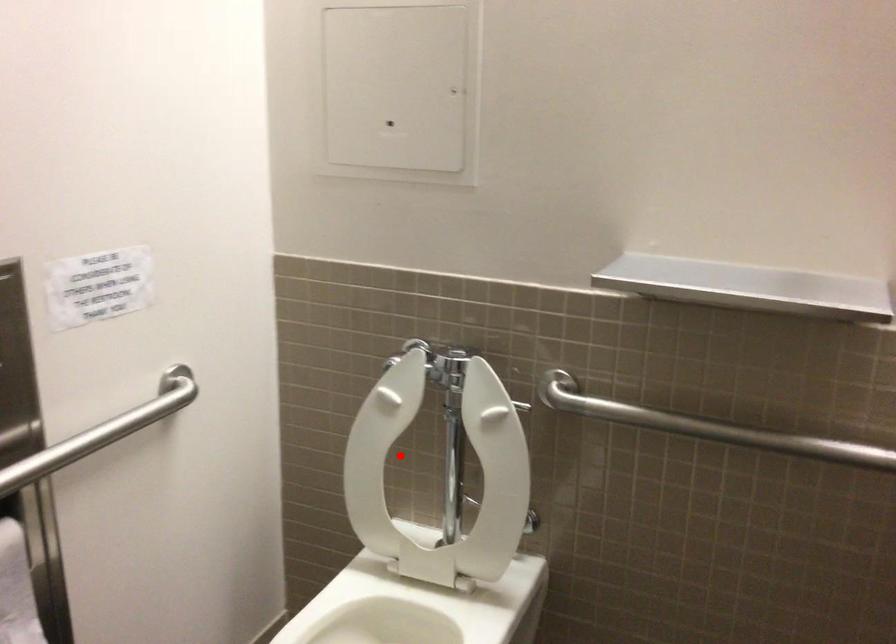
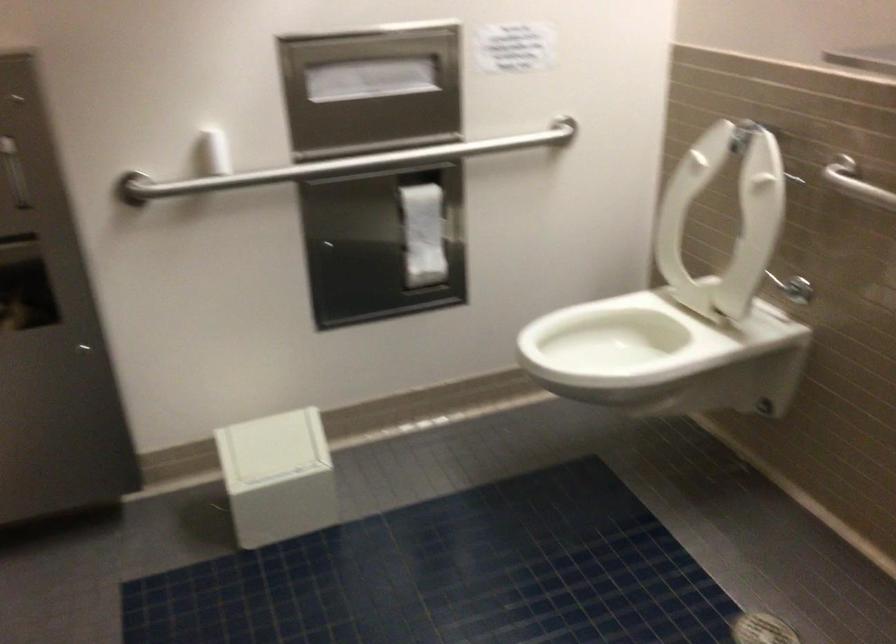
Question: I am providing you with two images of the same scene from different viewpoints. A red point is shown in image1. For the corresponding object point in image2, is it positioned nearer or farther from the camera?

Choices:
 (A) Nearer
 (B) Farther

Answer: (B)